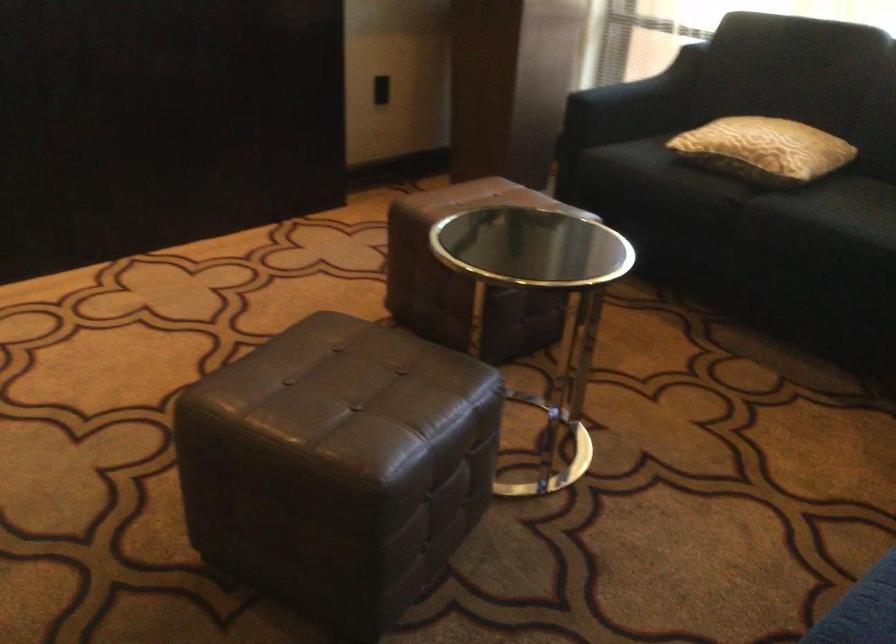
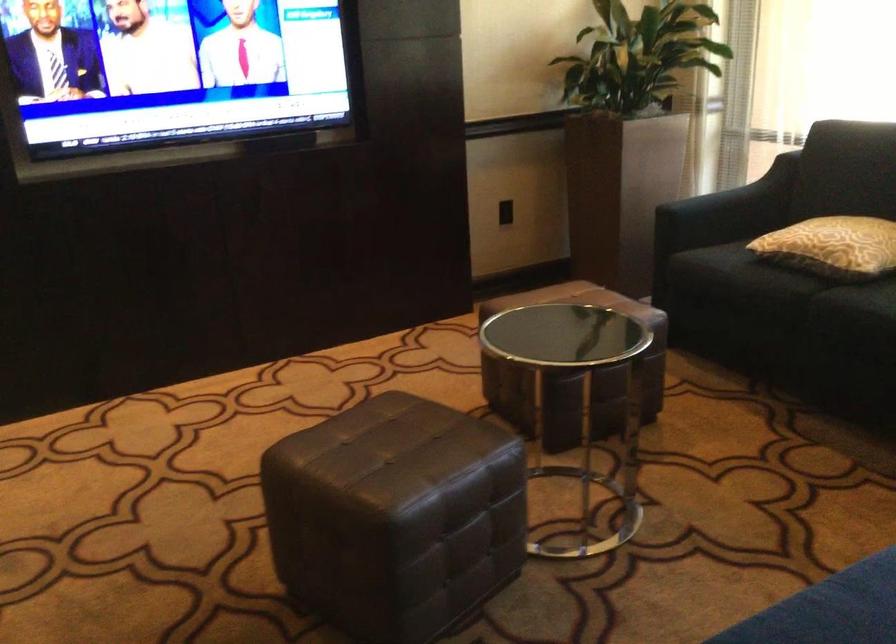
Question: How did the camera likely rotate?

Choices:
 (A) Left
 (B) Right
 (C) Up
 (D) Down

Answer: (A)